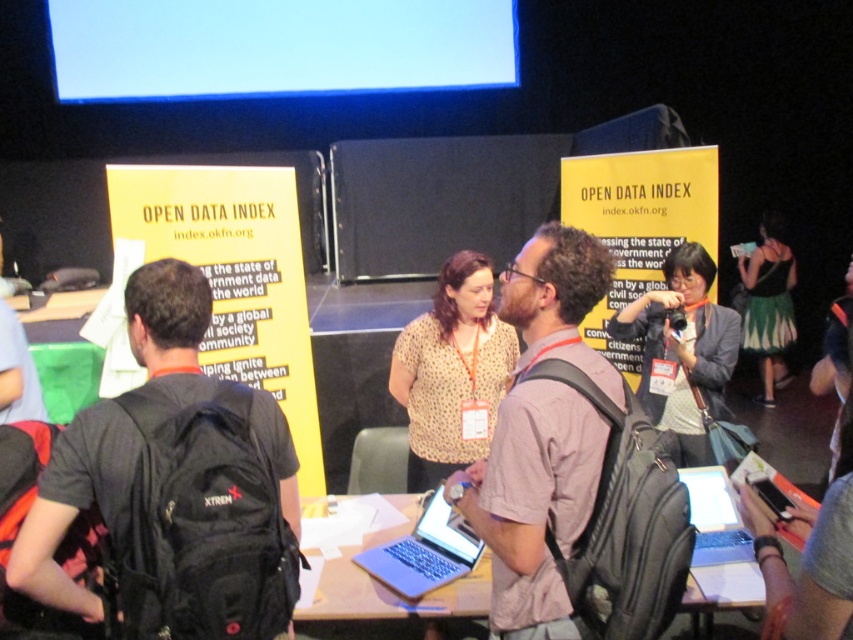
Where is `yellow paperboard at upper center`? This screenshot has width=853, height=640. yellow paperboard at upper center is located at coordinates (637, 225).

Is point (666, 179) less distant than point (345, 616)?

That is False.

Where is `yellow paperboard at upper center`? yellow paperboard at upper center is located at coordinates coord(637,225).

Measure the distance from floral-patterned blouse at center to silver metallic table at center.

They are 22.19 inches apart.

Can you confirm if floral-patterned blouse at center is smaller than silver metallic table at center?

No, floral-patterned blouse at center is not smaller than silver metallic table at center.

You are a GUI agent. You are given a task and a screenshot of the screen. Output one action in this format:
    pyautogui.click(x=<x>, y=<y>)
    Task: Click on the floral-patterned blouse at center
    
    Given the screenshot: What is the action you would take?
    pyautogui.click(x=451, y=371)

Based on the photo, does green textured dress at right have a lesser width compared to slate gray laptop at center?

No, green textured dress at right is not thinner than slate gray laptop at center.

Which is more to the right, green textured dress at right or slate gray laptop at center?

From the viewer's perspective, green textured dress at right appears more on the right side.

Is point (776, 291) behind point (433, 548)?

Yes, point (776, 291) is behind point (433, 548).

I want to click on green textured dress at right, so click(769, 304).